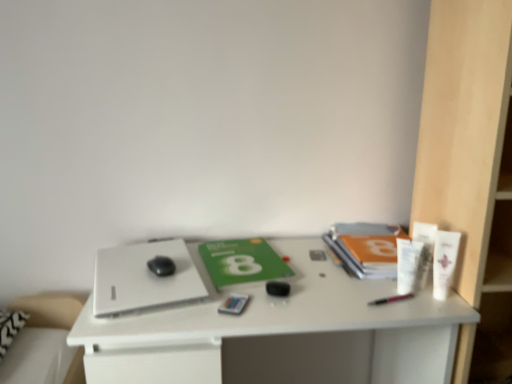
Question: Is white matte desk at center smaller than white plastic bookshelf at right?

Choices:
 (A) yes
 (B) no

Answer: (B)

Question: Does white matte desk at center appear on the right side of white plastic bookshelf at right?

Choices:
 (A) no
 (B) yes

Answer: (A)

Question: Does white matte desk at center come behind white plastic bookshelf at right?

Choices:
 (A) no
 (B) yes

Answer: (B)

Question: From the image's perspective, is white matte desk at center located beneath white plastic bookshelf at right?

Choices:
 (A) yes
 (B) no

Answer: (A)

Question: Does white matte desk at center have a lesser width compared to white plastic bookshelf at right?

Choices:
 (A) no
 (B) yes

Answer: (A)

Question: Can you confirm if white matte desk at center is bigger than white plastic bookshelf at right?

Choices:
 (A) no
 (B) yes

Answer: (B)

Question: Can you confirm if white plastic tube at right, the first toiletry from the left, is shorter than white matte desk at center?

Choices:
 (A) no
 (B) yes

Answer: (B)

Question: From the image's perspective, is white plastic tube at right, the third toiletry positioned from the right, beneath white matte desk at center?

Choices:
 (A) yes
 (B) no

Answer: (B)

Question: Is white matte desk at center surrounded by white plastic tube at right, the first toiletry from the left?

Choices:
 (A) yes
 (B) no

Answer: (B)

Question: Is white plastic tube at right, the third toiletry positioned from the right, smaller than white matte desk at center?

Choices:
 (A) no
 (B) yes

Answer: (B)

Question: Is white plastic tube at right, the third toiletry positioned from the right, outside white matte desk at center?

Choices:
 (A) no
 (B) yes

Answer: (B)

Question: Can you confirm if white plastic tube at right, the third toiletry positioned from the right, is bigger than white matte desk at center?

Choices:
 (A) no
 (B) yes

Answer: (A)

Question: Is white matte desk at center turned away from matte plastic card at center, which appears as the first stationery when viewed from the left?

Choices:
 (A) yes
 (B) no

Answer: (B)